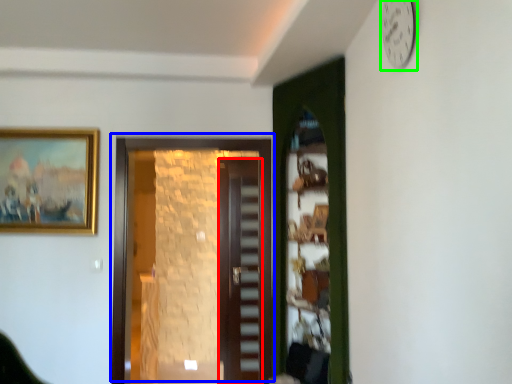
Question: Considering the real-world distances, which object is farthest from door (highlighted by a red box)? door (highlighted by a blue box) or clock (highlighted by a green box)?

Choices:
 (A) door
 (B) clock

Answer: (B)